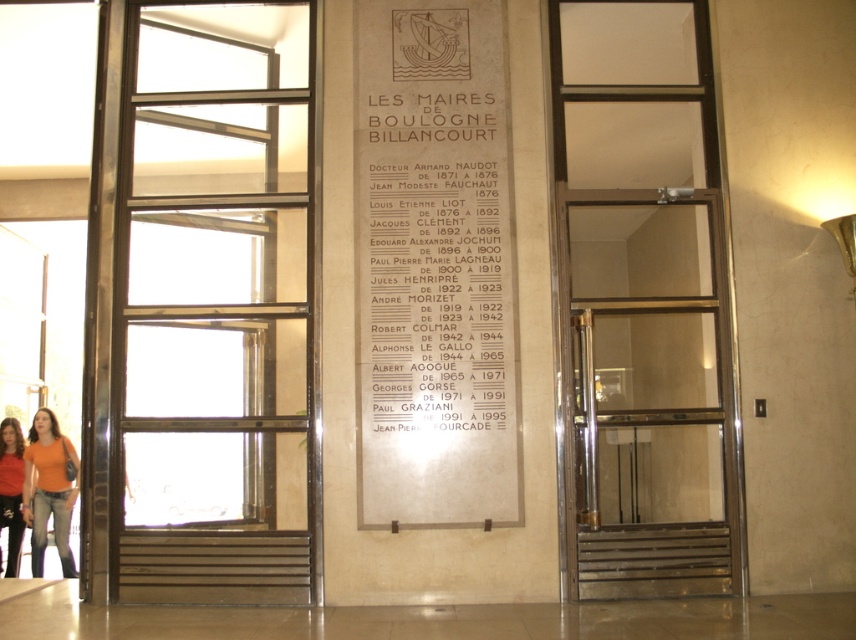
Question: Does polished metal elevator at center appear on the left side of orange t-shirt at lower left?

Choices:
 (A) no
 (B) yes

Answer: (A)

Question: Based on their relative distances, which object is farther from the white paper at center?

Choices:
 (A) orange t-shirt at lower left
 (B) polished metal elevator at center
 (C) polished brass elevator at center

Answer: (A)

Question: Does white paper at center have a lesser width compared to orange t-shirt at lower left?

Choices:
 (A) no
 (B) yes

Answer: (A)

Question: Where is white paper at center located in relation to orange t-shirt at lower left in the image?

Choices:
 (A) below
 (B) above

Answer: (B)

Question: Which point is farther to the camera?

Choices:
 (A) polished brass elevator at center
 (B) orange t-shirt at lower left
 (C) white paper at center
 (D) matte orange shirt at lower left

Answer: (D)

Question: Which object appears closest to the camera in this image?

Choices:
 (A) matte orange shirt at lower left
 (B) orange t-shirt at lower left

Answer: (B)